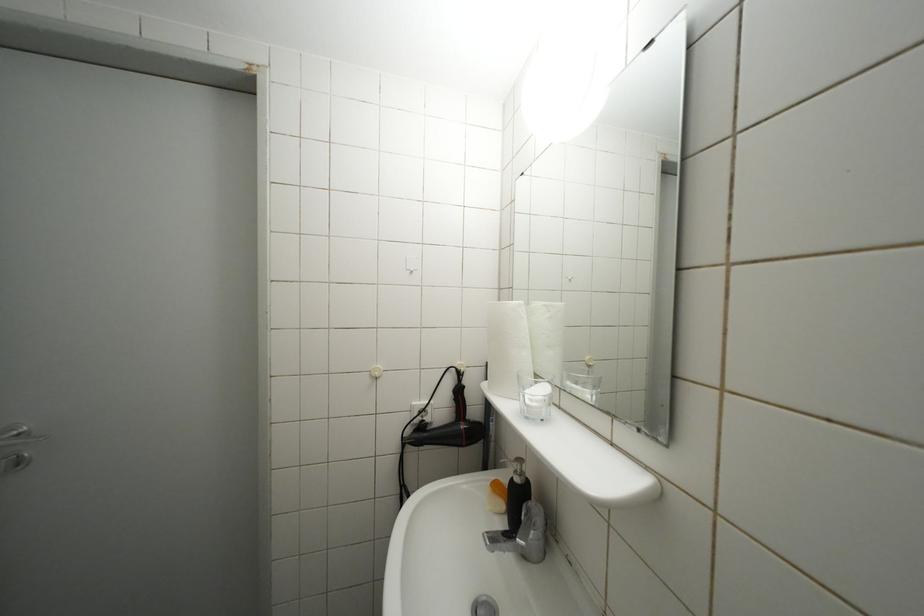
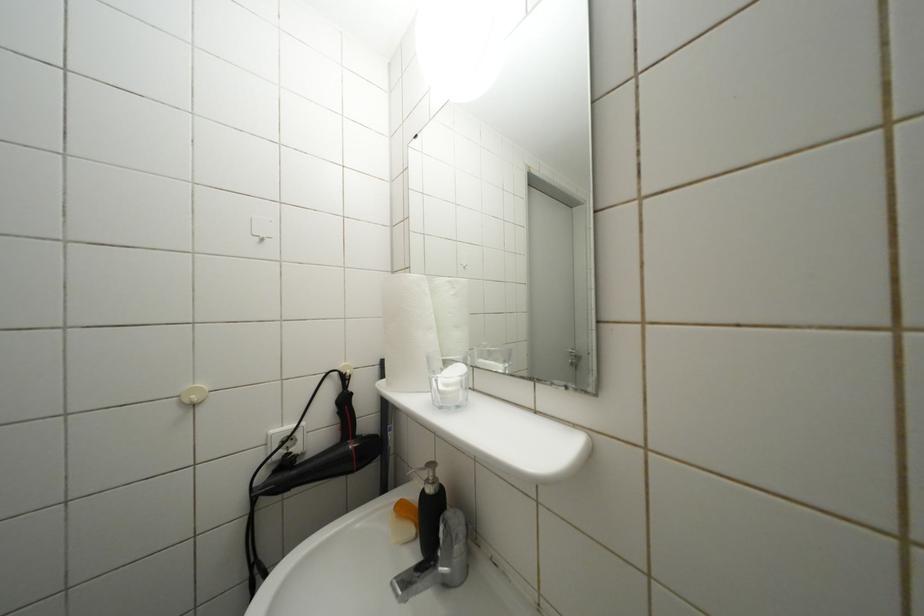
Question: Which direction would the cameraman need to move to produce the second image? Reply with the corresponding letter.

Choices:
 (A) Left
 (B) Right
 (C) Forward
 (D) Backward

Answer: (C)